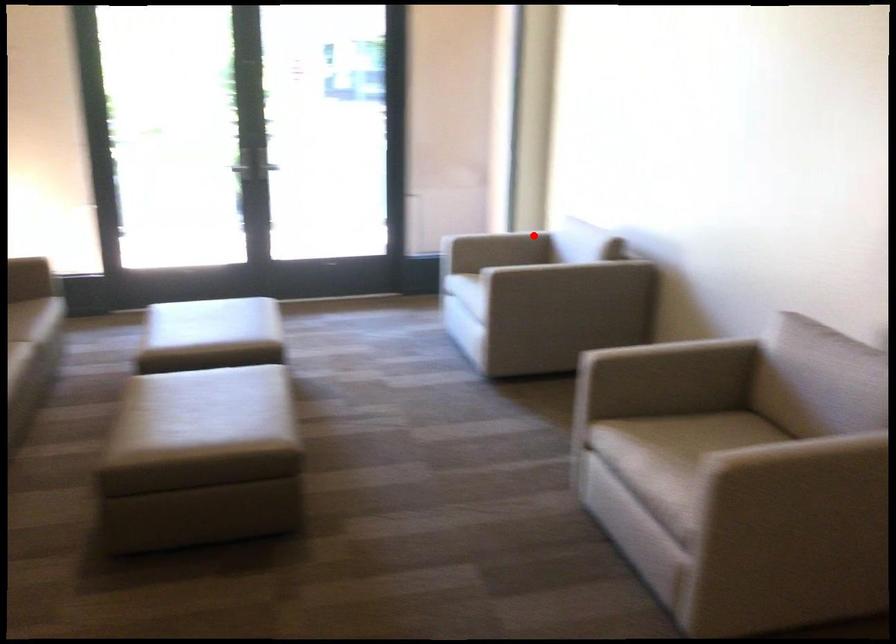
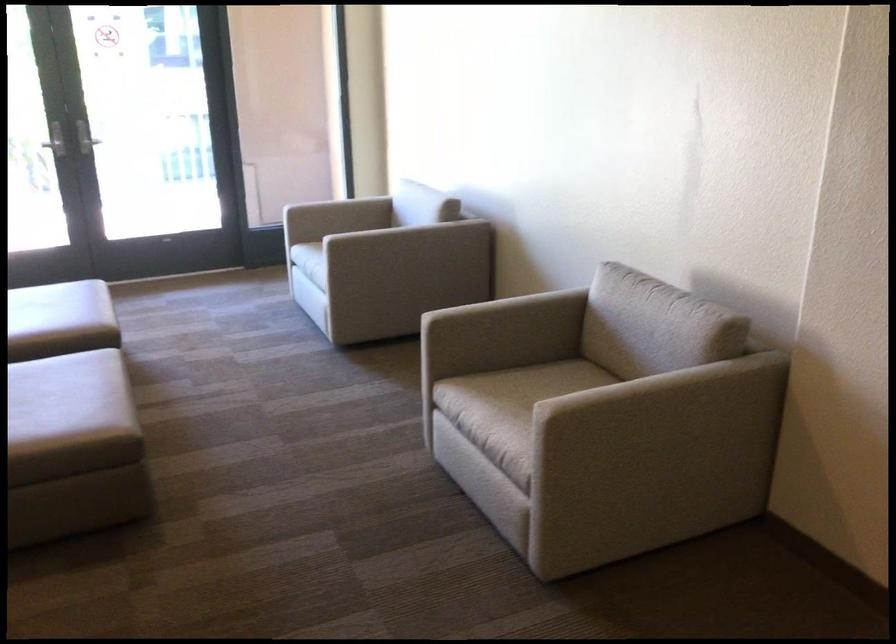
Where in the second image is the point corresponding to the highlighted location from the first image?

(375, 200)